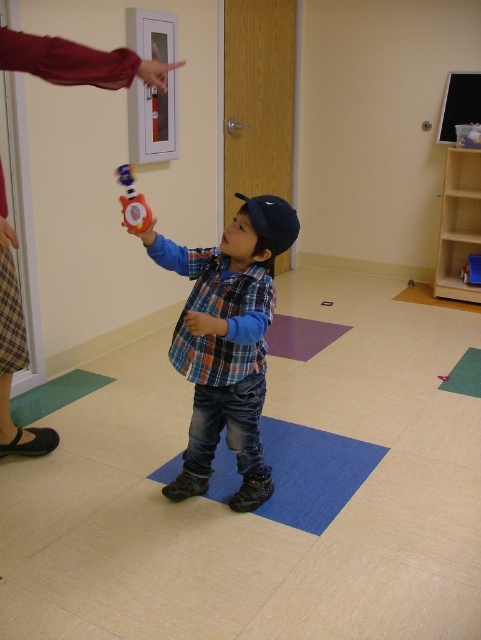
Does plaid shirt at center have a larger size compared to rubberized red fire extinguisher at center?

Yes, plaid shirt at center is bigger than rubberized red fire extinguisher at center.

Which is more to the right, plaid shirt at center or rubberized red fire extinguisher at center?

plaid shirt at center is more to the right.

The image size is (481, 640). What do you see at coordinates (227, 342) in the screenshot?
I see `plaid shirt at center` at bounding box center [227, 342].

Find the location of a particular element. The width and height of the screenshot is (481, 640). plaid shirt at center is located at coordinates (227, 342).